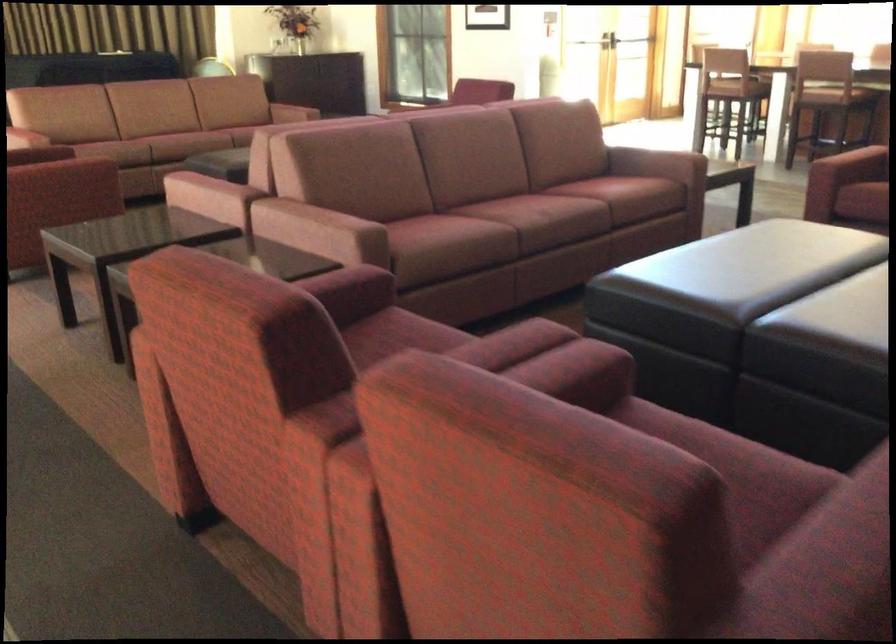
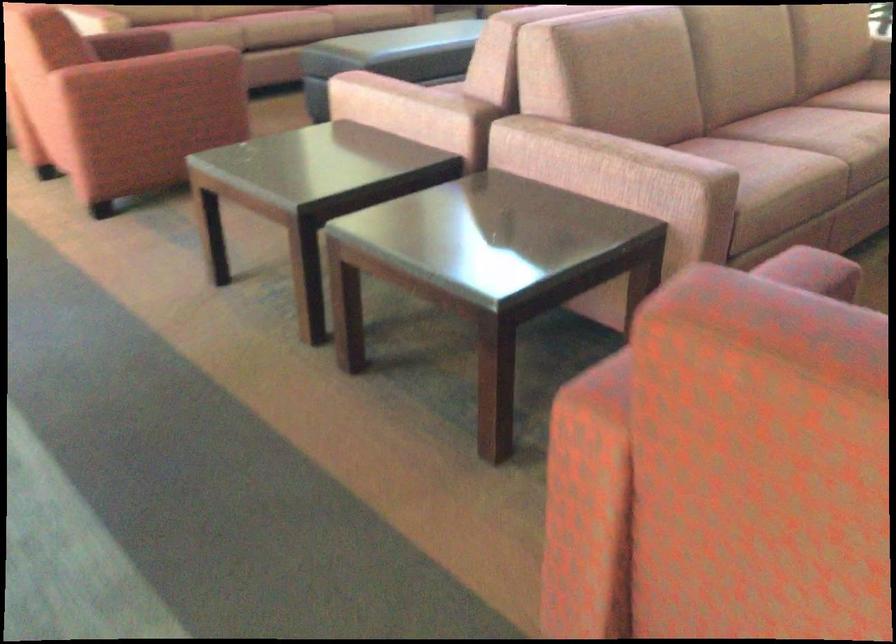
Which direction would the cameraman need to move to produce the second image?

The cameraman moved toward left, forward.